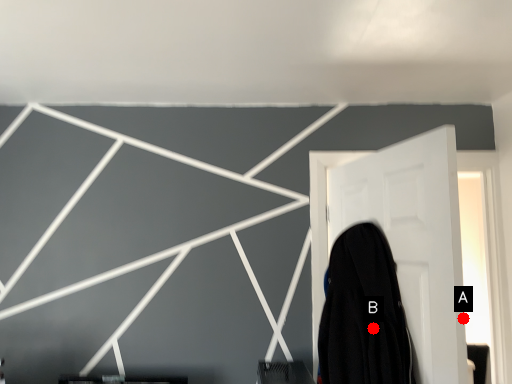
Question: Two points are circled on the image, labeled by A and B beside each circle. Which point is farther from the camera taking this photo?

Choices:
 (A) A is further
 (B) B is further

Answer: (B)